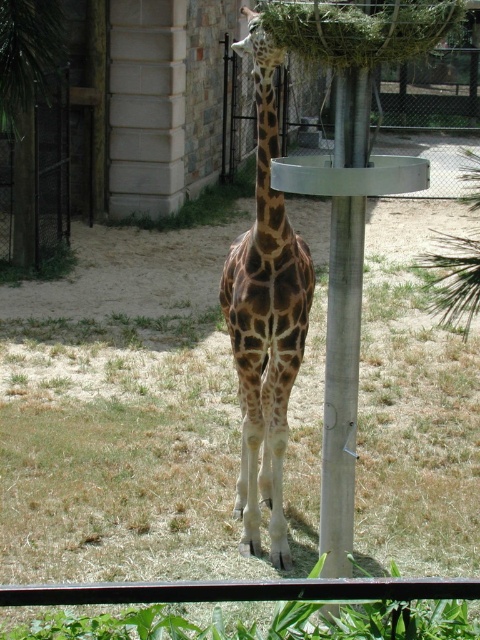
Is point (410, 349) positioned behind point (348, 138)?

Yes, it is.

Which is behind, point (203, 552) or point (358, 134)?

The point (203, 552) is more distant.

Where is `green grass at center`? The width and height of the screenshot is (480, 640). green grass at center is located at coordinates (119, 454).

Can you confirm if spotted fur giraffe at center is positioned to the left of metallic pole at center?

Yes, spotted fur giraffe at center is to the left of metallic pole at center.

Is spotted fur giraffe at center to the right of metallic pole at center from the viewer's perspective?

In fact, spotted fur giraffe at center is to the left of metallic pole at center.

Which is behind, point (253, 342) or point (328, 465)?

Positioned behind is point (253, 342).

Where is `spotted fur giraffe at center`? spotted fur giraffe at center is located at coordinates (264, 316).

Based on the photo, between green grass at center and spotted fur giraffe at center, which one has less height?

green grass at center

Does green grass at center appear over spotted fur giraffe at center?

No, green grass at center is not above spotted fur giraffe at center.

Is point (408, 296) positioned before point (283, 513)?

No, it is not.

The width and height of the screenshot is (480, 640). I want to click on green grass at center, so click(119, 454).